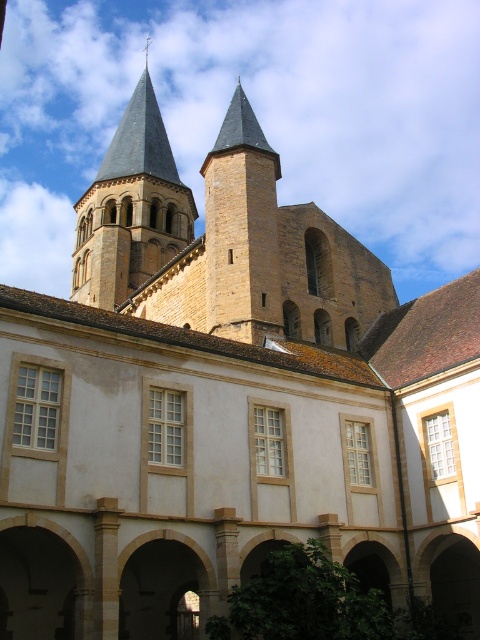
Question: Does smooth gray steeple at upper center have a lesser width compared to smooth stone tower at center?

Choices:
 (A) no
 (B) yes

Answer: (A)

Question: Is smooth gray steeple at upper center thinner than smooth stone tower at center?

Choices:
 (A) no
 (B) yes

Answer: (A)

Question: Which of the following is the closest to the observer?

Choices:
 (A) smooth gray steeple at upper center
 (B) smooth stone tower at center

Answer: (B)

Question: Can you confirm if smooth gray steeple at upper center is wider than smooth stone tower at center?

Choices:
 (A) yes
 (B) no

Answer: (A)